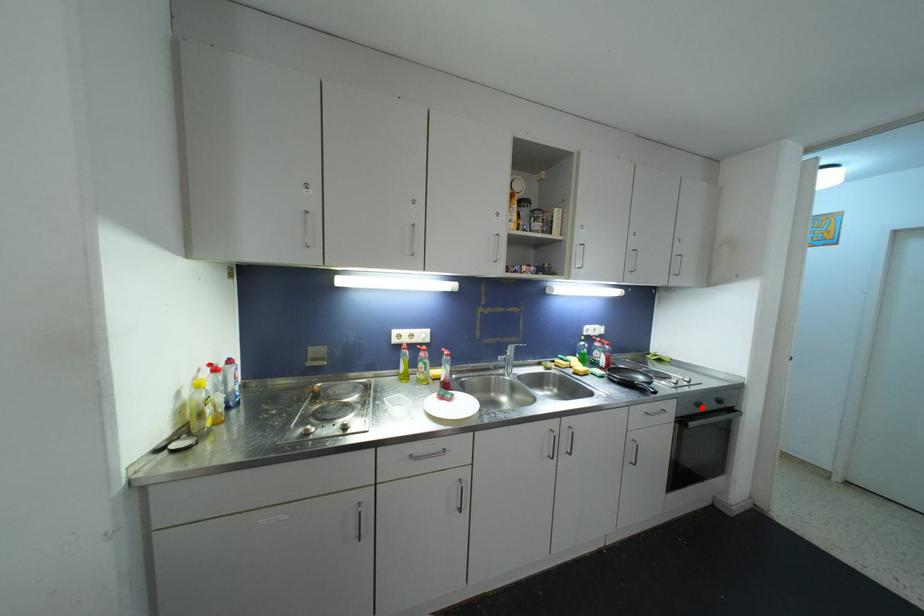
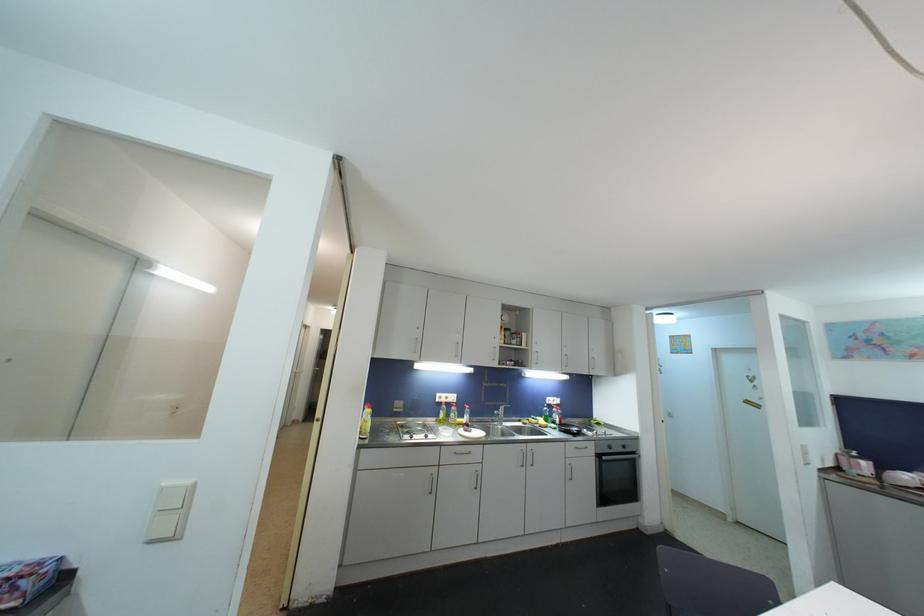
Find the pixel in the second image that matches the highlighted location in the first image.

(613, 450)